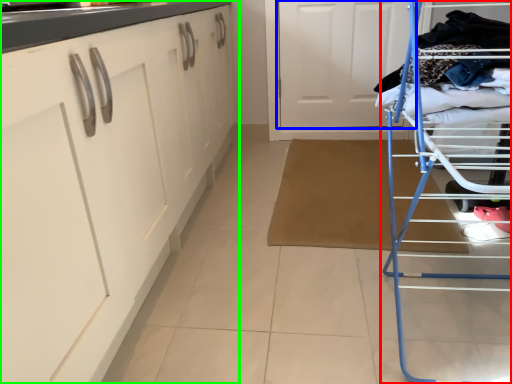
Question: Considering the real-world distances, which object is farthest from furniture (highlighted by a red box)? door (highlighted by a blue box) or cabinetry (highlighted by a green box)?

Choices:
 (A) door
 (B) cabinetry

Answer: (A)